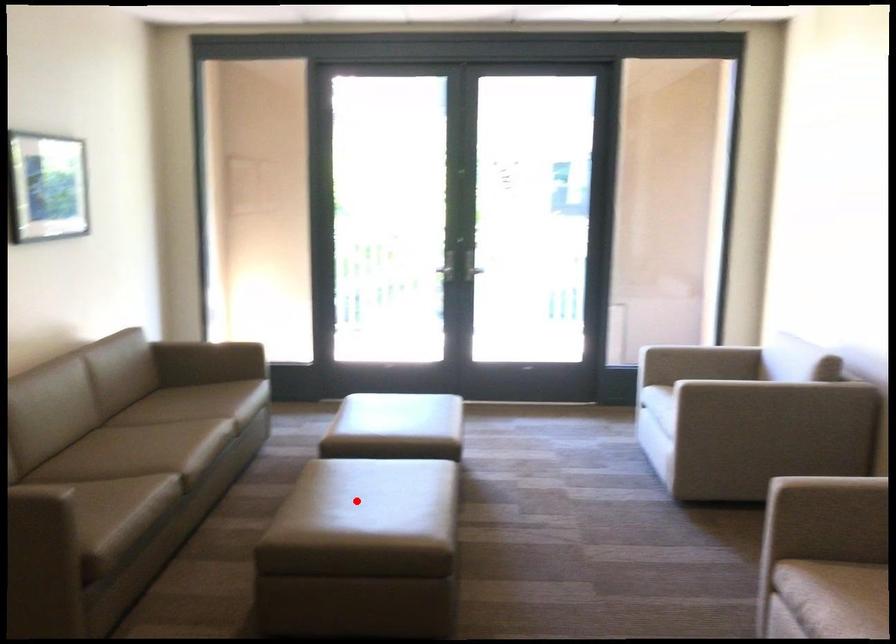
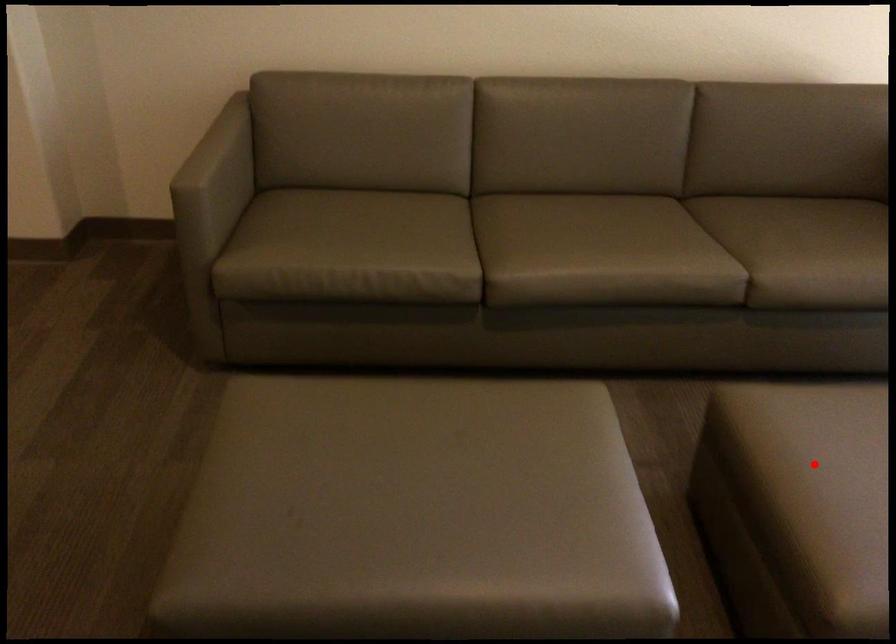
I am providing you with two images of the same scene from different viewpoints. A red point is marked on the first image and another point is marked on the second image. Do the highlighted points in image1 and image2 indicate the same real-world spot?

No